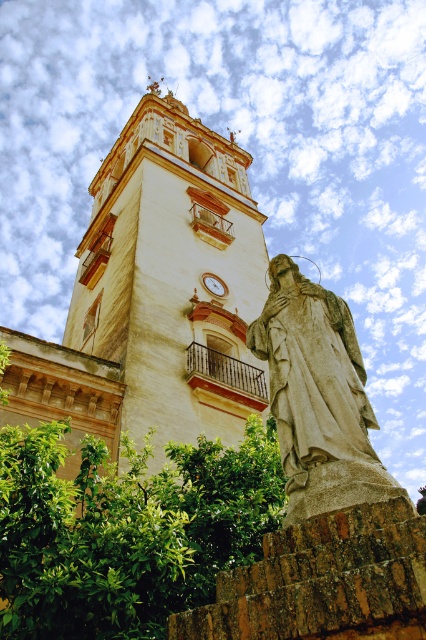
What do you see at coordinates (172, 276) in the screenshot? I see `beige stone tower at center` at bounding box center [172, 276].

Can you confirm if beige stone tower at center is smaller than stone statue at center?

No.

The image size is (426, 640). What do you see at coordinates (172, 276) in the screenshot?
I see `beige stone tower at center` at bounding box center [172, 276].

Where is `beige stone tower at center`? The image size is (426, 640). beige stone tower at center is located at coordinates coord(172,276).

Does stone statue at center have a smaller size compared to gold metallic clock at center?

No, stone statue at center is not smaller than gold metallic clock at center.

What do you see at coordinates (317, 396) in the screenshot? The image size is (426, 640). I see `stone statue at center` at bounding box center [317, 396].

What do you see at coordinates (317, 396) in the screenshot? This screenshot has width=426, height=640. I see `stone statue at center` at bounding box center [317, 396].

Where is `stone statue at center`? The height and width of the screenshot is (640, 426). stone statue at center is located at coordinates (317, 396).

Is the position of beige stone tower at center more distant than that of gold metallic clock at center?

That is False.

Can you confirm if beige stone tower at center is positioned above gold metallic clock at center?

Yes.

Between point (95, 182) and point (210, 289), which one is positioned in front?

Positioned in front is point (210, 289).

Where is `beige stone tower at center`? The height and width of the screenshot is (640, 426). beige stone tower at center is located at coordinates (172, 276).